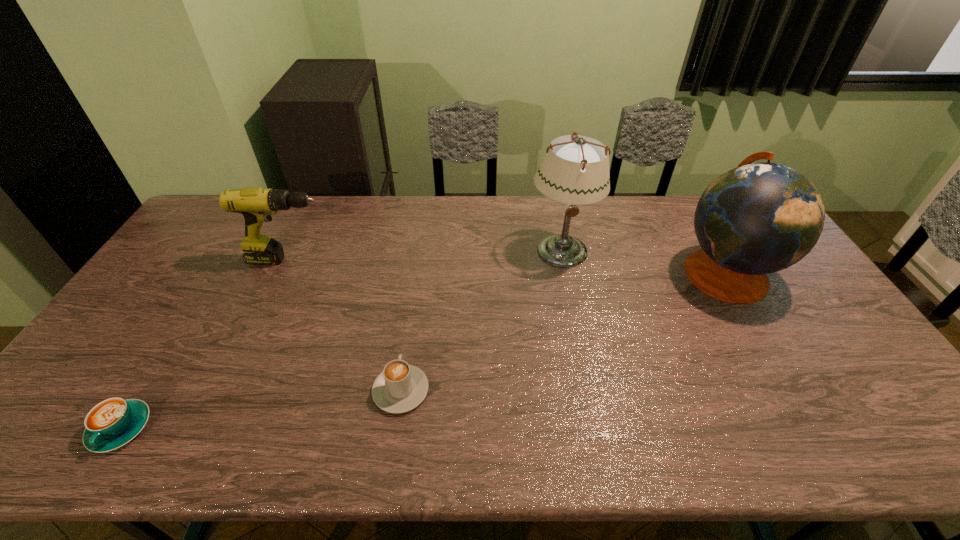
Where is `vacant area that satisfies the following two spatial constraints: 1. on the lampshade of the fourth object from left to right; 2. on the handle side of the third tallest object`? This screenshot has height=540, width=960. vacant area that satisfies the following two spatial constraints: 1. on the lampshade of the fourth object from left to right; 2. on the handle side of the third tallest object is located at coordinates (563, 260).

This screenshot has width=960, height=540. Find the location of `vacant region that satisfies the following two spatial constraints: 1. on the handle side of the second object from left to right; 2. with the handle on the right side of the leftmost object`. vacant region that satisfies the following two spatial constraints: 1. on the handle side of the second object from left to right; 2. with the handle on the right side of the leftmost object is located at coordinates (212, 428).

You are a GUI agent. You are given a task and a screenshot of the screen. Output one action in this format:
    pyautogui.click(x=<x>, y=<y>)
    Task: Click on the free space that satisfies the following two spatial constraints: 1. on the lampshade of the lampshade; 2. on the handle side of the third tallest object
    The height and width of the screenshot is (540, 960).
    Given the screenshot: What is the action you would take?
    pyautogui.click(x=563, y=260)

Where is `vacant space that satisfies the following two spatial constraints: 1. on the handle side of the drill; 2. with the handle on the right side of the shortest object`? vacant space that satisfies the following two spatial constraints: 1. on the handle side of the drill; 2. with the handle on the right side of the shortest object is located at coordinates (212, 428).